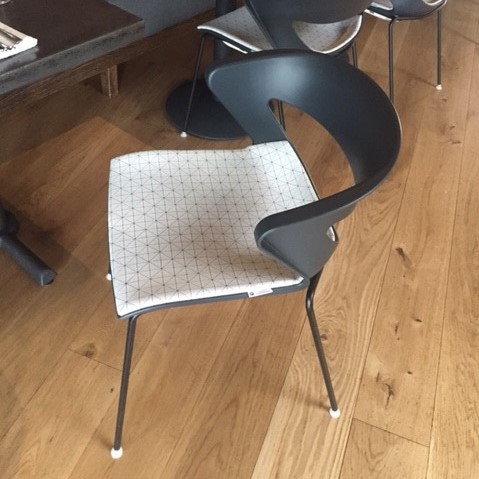
Find the location of `white plastic patterned chair surface`. white plastic patterned chair surface is located at coordinates (206, 214), (325, 30), (384, 1).